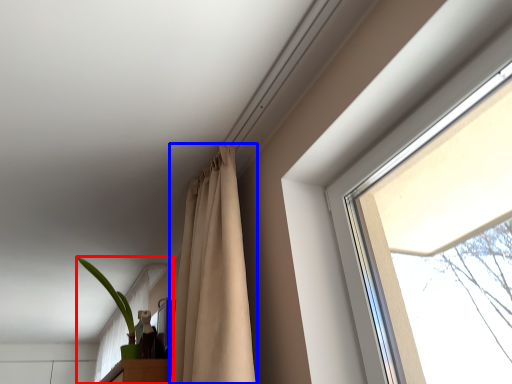
Question: Which object is closer to the camera taking this photo, houseplant (highlighted by a red box) or curtain (highlighted by a blue box)?

Choices:
 (A) houseplant
 (B) curtain

Answer: (B)